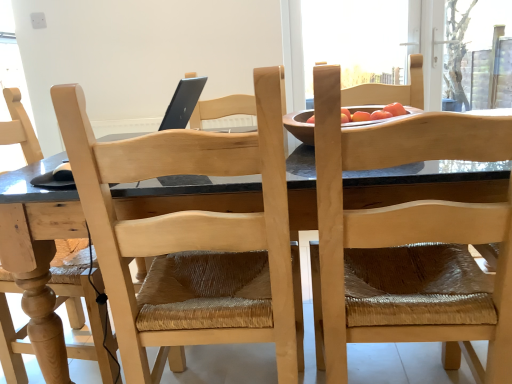
Question: Is transparent plastic screen at upper right, which is counted as the 2th window screen, starting from the left, bigger or smaller than natural wood chair at upper right, which is counted as the second chair, starting from the left?

Choices:
 (A) small
 (B) big

Answer: (A)

Question: From their relative heights in the image, would you say transparent plastic screen at upper right, which is counted as the 2th window screen, starting from the left, is taller or shorter than natural wood chair at upper right, which is counted as the second chair, starting from the left?

Choices:
 (A) tall
 (B) short

Answer: (B)

Question: Which object is the closest to the natural wood chair at center, the first chair when ordered from left to right?

Choices:
 (A) transparent glass window screen at upper center, positioned as the 2th window screen in right-to-left order
 (B) transparent plastic screen at upper right, which is counted as the 2th window screen, starting from the left
 (C) natural wood chair at upper right, which is counted as the second chair, starting from the left

Answer: (C)

Question: Estimate the real-world distances between objects in this image. Which object is closer to the transparent plastic screen at upper right, which is the first window screen in right-to-left order?

Choices:
 (A) transparent glass window screen at upper center, the 1th window screen in the left-to-right sequence
 (B) natural wood chair at center, the first chair when ordered from left to right
 (C) natural wood chair at upper right, marked as the first chair in a right-to-left arrangement

Answer: (A)